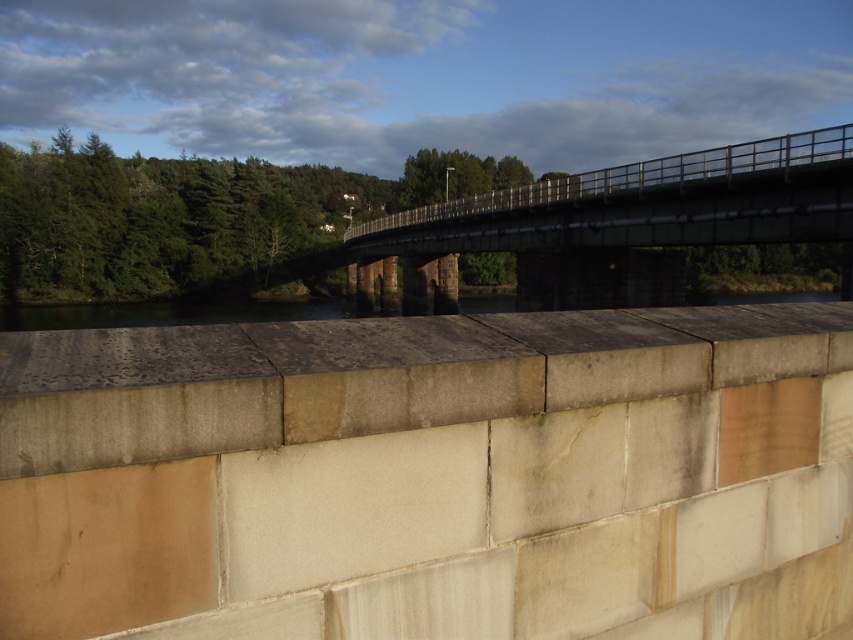
You are a delivery drone with a wingspan of 1.5 meters. You need to fly from the smooth concrete ledge at center to the green metal pedestrian bridge at center. Is there enough space between them for your drone to pass safely?

The smooth concrete ledge at center and green metal pedestrian bridge at center are 38.73 meters apart from each other. Since your drone has a wingspan of 1.5 meters, the distance between them is more than sufficient for safe passage.

You are a landscape architect designing a new pathway. You need to place a bench on the smooth concrete ledge at center and a statue on the green metal pedestrian bridge at center. Which object will have more space for the items you want to place?

The green metal pedestrian bridge at center has a larger size compared to the smooth concrete ledge at center, so the statue can be placed with more space on the green metal pedestrian bridge at center.

You are standing on the smooth concrete ledge at center and want to cross to the other side of the green metal pedestrian bridge at center. Which direction should you move to reach the bridge?

The smooth concrete ledge at center is below the green metal pedestrian bridge at center, so you should move upward to reach the bridge.